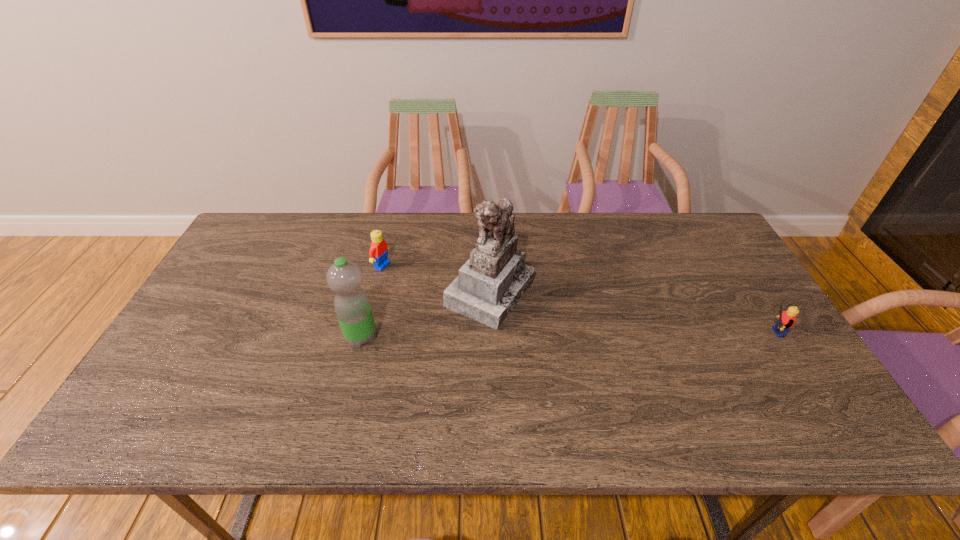
Identify the location of free space on the desktop that is between the water bottle and the nearer Lego and is positioned on the front-facing side of the third object from left to right. This screenshot has height=540, width=960. (592, 335).

Locate an element on the screen. This screenshot has height=540, width=960. vacant space on the desktop that is between the water bottle and the nearer Lego and is positioned on the face of the left Lego is located at coordinates (550, 335).